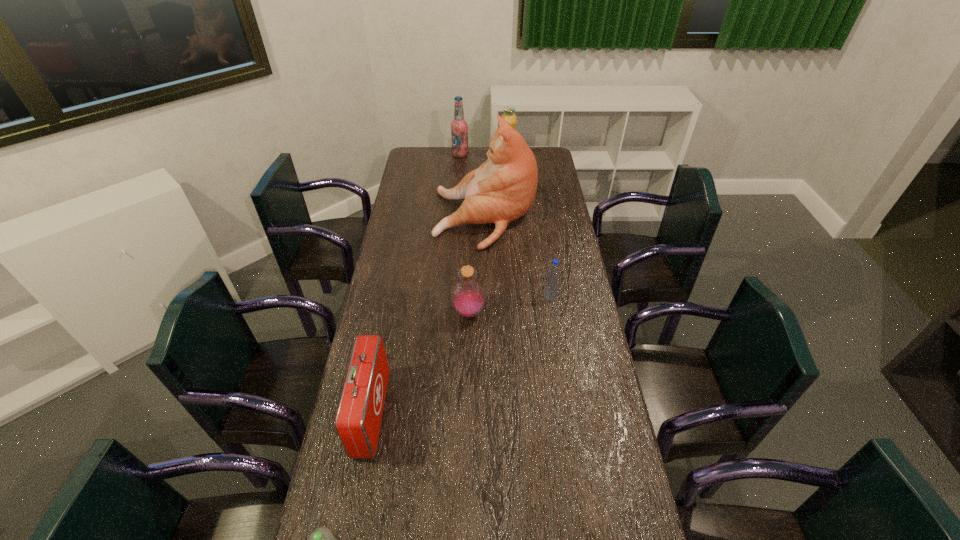
This screenshot has height=540, width=960. In order to click on cat in this screenshot , I will do [503, 188].

Where is `the third farthest object`? Image resolution: width=960 pixels, height=540 pixels. the third farthest object is located at coordinates (503, 188).

The width and height of the screenshot is (960, 540). Identify the location of alcohol. (459, 127).

Find the location of a particular element. The height and width of the screenshot is (540, 960). fruit juice is located at coordinates (509, 116).

This screenshot has width=960, height=540. In order to click on the first-aid kit in this screenshot , I will do `click(358, 419)`.

Find the location of `bottle`. bottle is located at coordinates (468, 297).

Find the location of a particular element. This screenshot has height=540, width=960. the right water bottle is located at coordinates (552, 281).

Find the location of `vacant space positioned on the face of the tallest object`. vacant space positioned on the face of the tallest object is located at coordinates (399, 219).

Identify the location of blank space located on the face of the tallest object. (405, 219).

Image resolution: width=960 pixels, height=540 pixels. I want to click on free space located on the face of the tallest object, so click(408, 219).